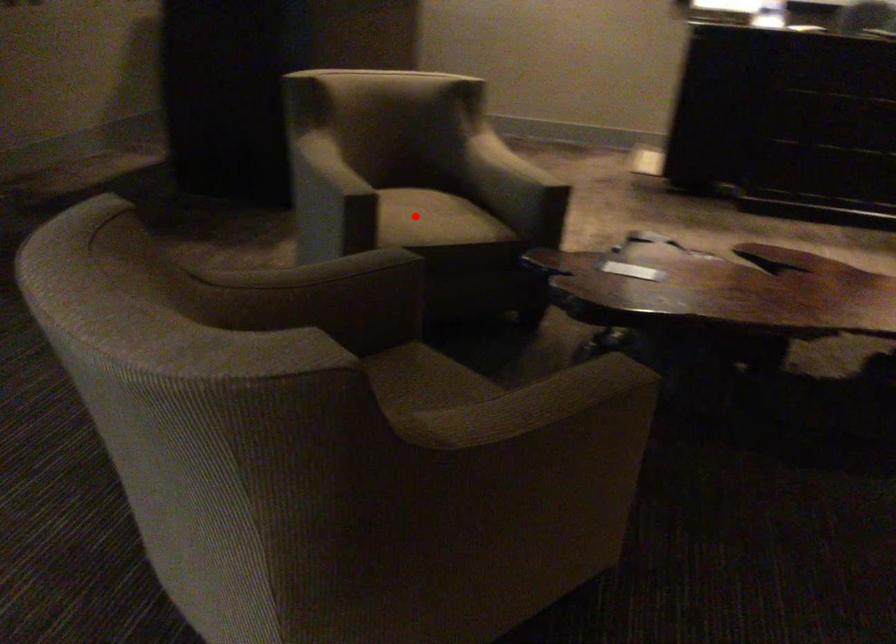
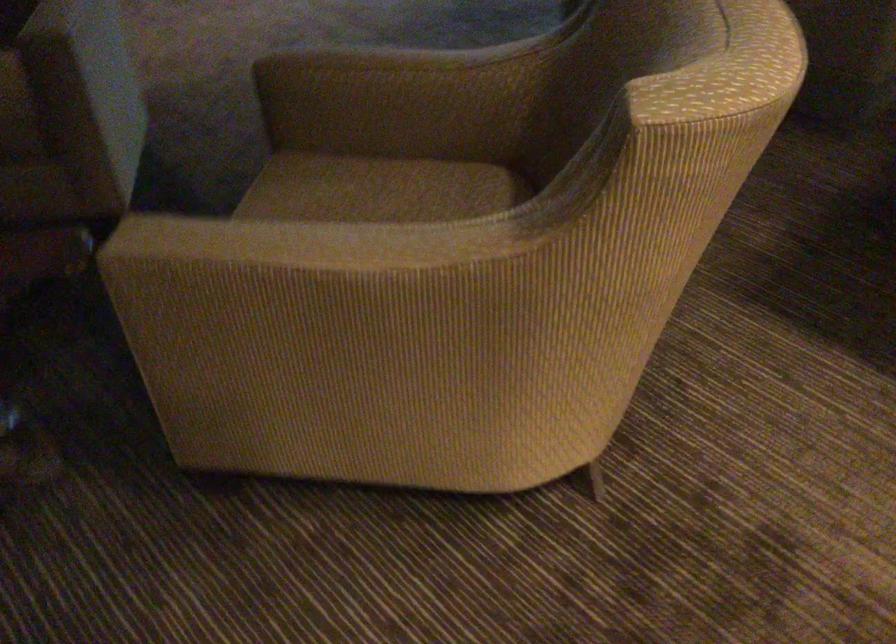
Where in the second image is the point corresponding to the highlighted location from the first image?

(380, 187)